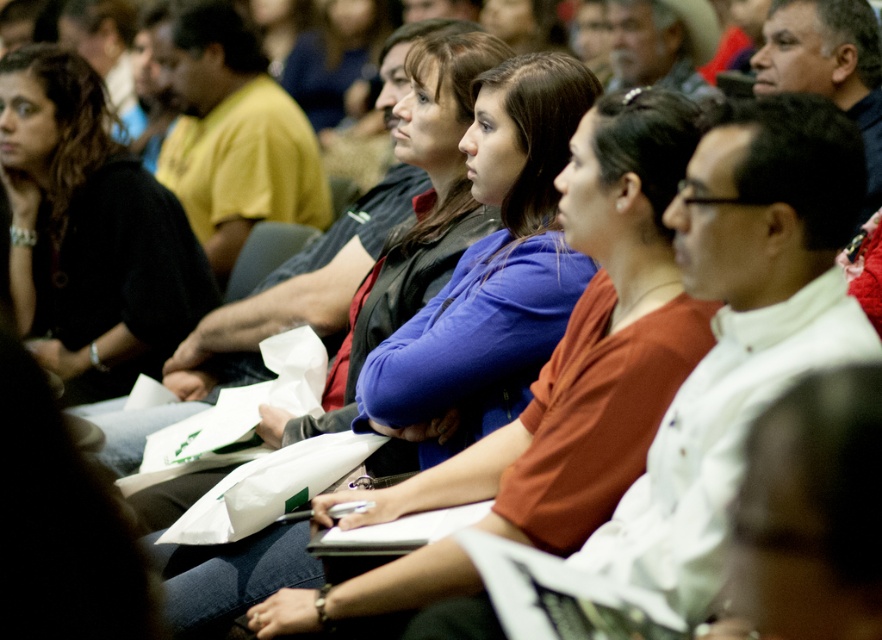
Question: Can you confirm if blue matte shirt at center is positioned to the right of yellow matte shirt at center?

Choices:
 (A) yes
 (B) no

Answer: (A)

Question: Where is blue matte shirt at center located in relation to yellow matte shirt at center in the image?

Choices:
 (A) left
 (B) right

Answer: (B)

Question: Which point is closer to the camera?

Choices:
 (A) yellow matte shirt at center
 (B) blue matte shirt at center

Answer: (B)

Question: Does blue matte shirt at center have a lesser width compared to yellow matte shirt at center?

Choices:
 (A) no
 (B) yes

Answer: (B)

Question: Among these objects, which one is nearest to the camera?

Choices:
 (A) yellow matte shirt at center
 (B) blue matte shirt at center

Answer: (B)

Question: Considering the real-world distances, which object is closest to the black sweater at left?

Choices:
 (A) yellow matte shirt at center
 (B) blue matte shirt at center

Answer: (A)